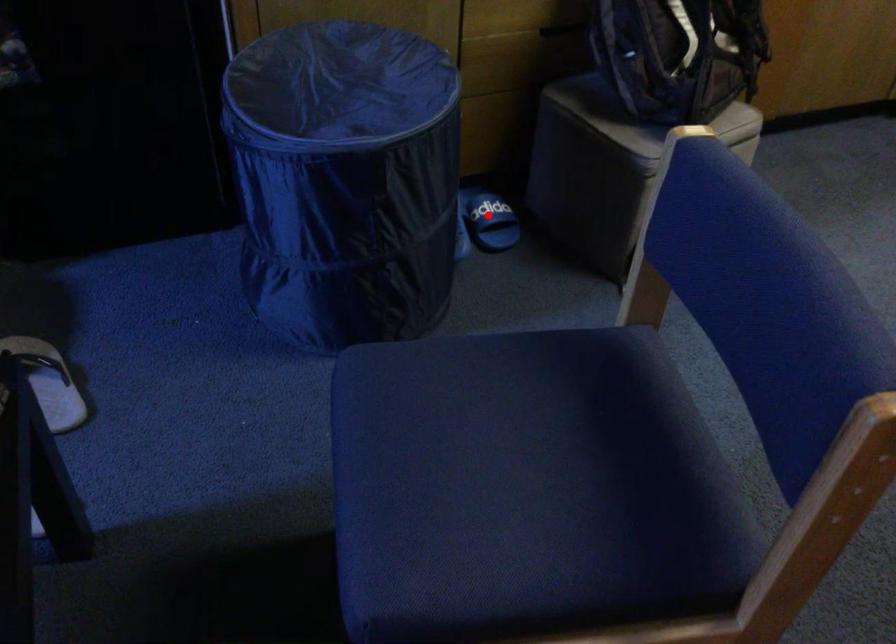
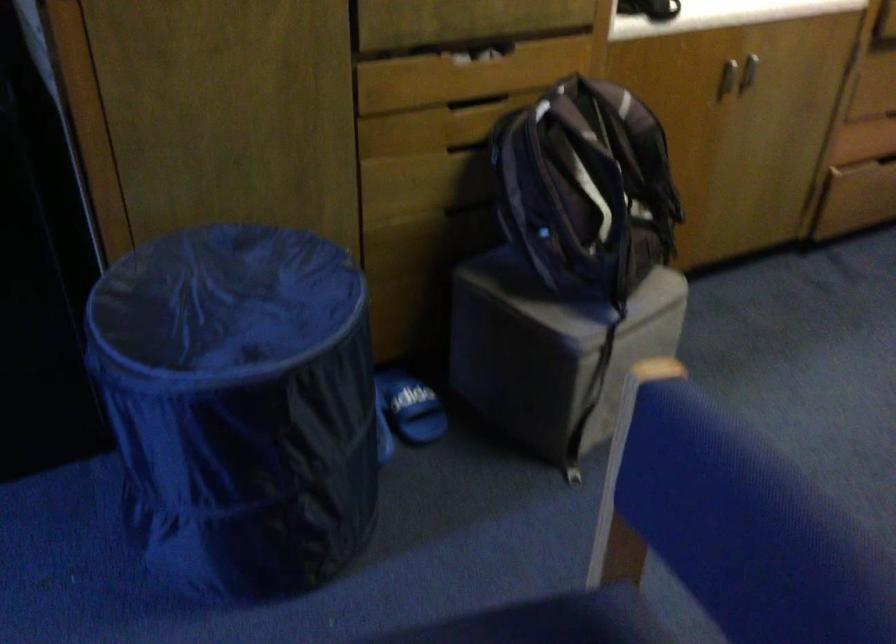
Question: I am providing you with two images of the same scene from different viewpoints. Image1 has a red point marked. In image2, the corresponding 3D location appears at what relative position? Reply with the corresponding letter.

Choices:
 (A) Closer
 (B) Farther

Answer: (A)